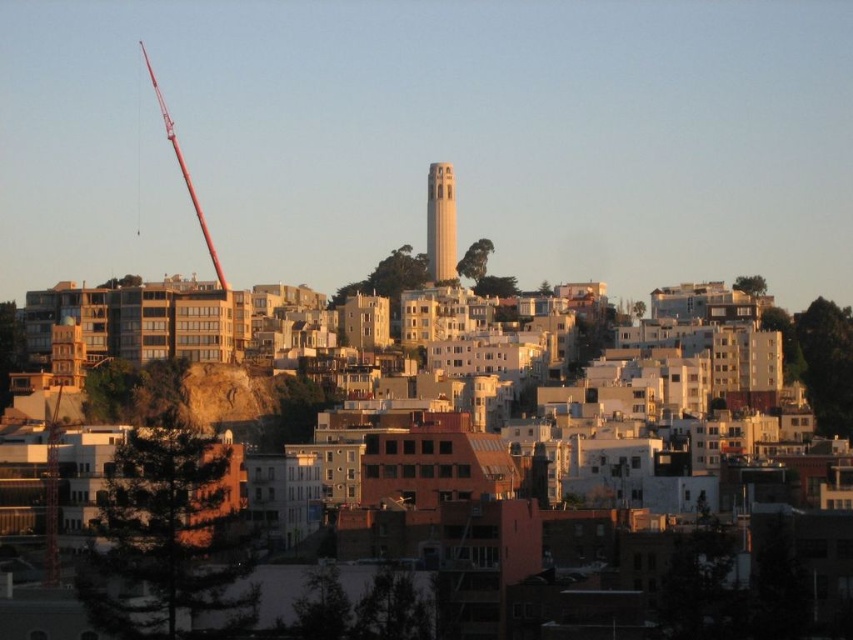
Question: Can you confirm if white concrete tower at center is positioned below metallic red crane at left?

Choices:
 (A) yes
 (B) no

Answer: (B)

Question: Can you confirm if white concrete tower at center is bigger than metallic red crane at left?

Choices:
 (A) yes
 (B) no

Answer: (B)

Question: Does white concrete tower at center lie behind metallic red crane at left?

Choices:
 (A) yes
 (B) no

Answer: (A)

Question: Which object is farther from the camera taking this photo?

Choices:
 (A) white concrete tower at center
 (B) metallic red crane at left

Answer: (A)

Question: Which point is closer to the camera?

Choices:
 (A) white concrete tower at center
 (B) metallic red crane at left

Answer: (B)

Question: Among these points, which one is farthest from the camera?

Choices:
 (A) (428, 182)
 (B) (212, 252)

Answer: (A)